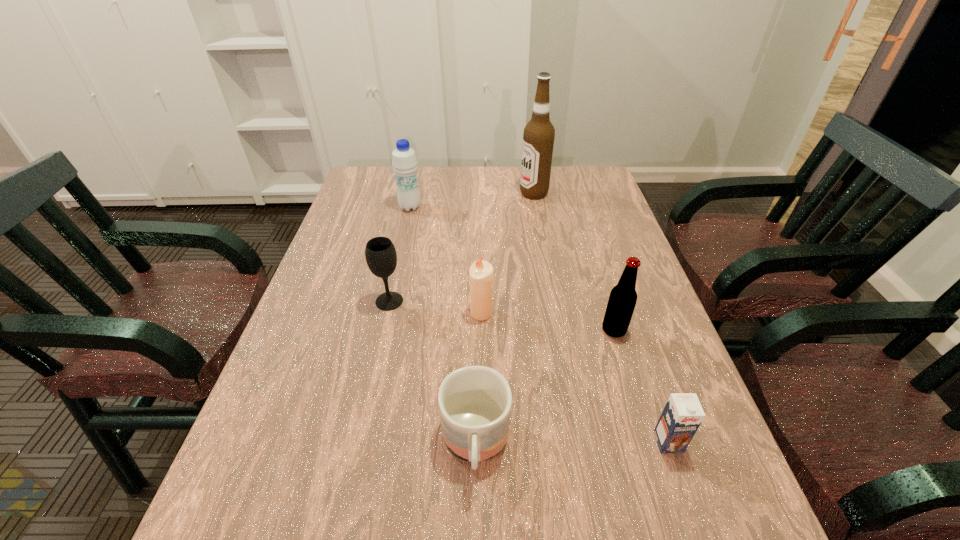
Locate an element on the screen. Image resolution: width=960 pixels, height=540 pixels. free region that satisfies the following two spatial constraints: 1. on the label of the beer bottle; 2. on the right side of the fifth object from left to right is located at coordinates (559, 330).